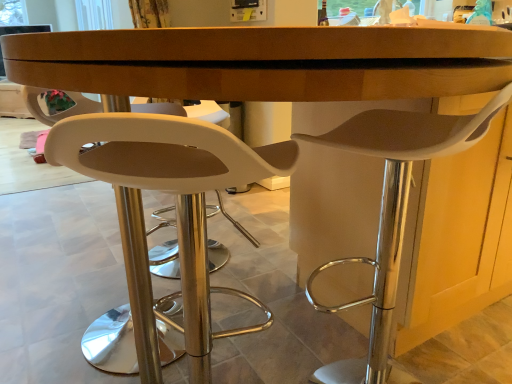
Question: Is white plastic chair at center, placed as the 2th chair when sorted from back to front, smaller than white plastic stool at right, which ranks as the second chair in left-to-right order?

Choices:
 (A) yes
 (B) no

Answer: (A)

Question: Can we say white plastic chair at center, placed as the 2th chair when sorted from back to front, lies outside white plastic stool at right, the second chair viewed from the front?

Choices:
 (A) no
 (B) yes

Answer: (B)

Question: Is there a large distance between white plastic chair at center, marked as the second chair in a right-to-left arrangement, and white plastic stool at right, which ranks as the second chair in left-to-right order?

Choices:
 (A) yes
 (B) no

Answer: (B)

Question: From a real-world perspective, does white plastic chair at center, which is counted as the first chair, starting from the left, sit lower than white plastic stool at right, which ranks as the second chair in left-to-right order?

Choices:
 (A) yes
 (B) no

Answer: (B)

Question: Could you tell me if white plastic chair at center, marked as the second chair in a right-to-left arrangement, is turned towards white plastic stool at right, the second chair viewed from the front?

Choices:
 (A) no
 (B) yes

Answer: (A)

Question: Considering the relative sizes of white plastic chair at center, acting as the 1th chair starting from the front, and white plastic stool at right, which ranks as the second chair in left-to-right order, in the image provided, is white plastic chair at center, acting as the 1th chair starting from the front, bigger than white plastic stool at right, which ranks as the second chair in left-to-right order,?

Choices:
 (A) no
 (B) yes

Answer: (A)

Question: Does white plastic stool at right, the second chair viewed from the front, appear on the left side of white plastic chair at center, marked as the second chair in a right-to-left arrangement?

Choices:
 (A) yes
 (B) no

Answer: (B)

Question: Does white plastic stool at right, the 1th chair viewed from the right, come behind white plastic chair at center, acting as the 1th chair starting from the front?

Choices:
 (A) no
 (B) yes

Answer: (B)

Question: From the image's perspective, is white plastic stool at right, the first chair from the back, on white plastic chair at center, which is counted as the first chair, starting from the left?

Choices:
 (A) no
 (B) yes

Answer: (B)

Question: From a real-world perspective, does white plastic stool at right, which ranks as the second chair in left-to-right order, stand above white plastic chair at center, placed as the 2th chair when sorted from back to front?

Choices:
 (A) no
 (B) yes

Answer: (A)

Question: Considering the relative sizes of white plastic stool at right, the 1th chair viewed from the right, and white plastic chair at center, marked as the second chair in a right-to-left arrangement, in the image provided, is white plastic stool at right, the 1th chair viewed from the right, shorter than white plastic chair at center, marked as the second chair in a right-to-left arrangement,?

Choices:
 (A) no
 (B) yes

Answer: (B)

Question: Is white plastic stool at right, the second chair viewed from the front, far from white plastic chair at center, marked as the second chair in a right-to-left arrangement?

Choices:
 (A) no
 (B) yes

Answer: (A)

Question: From a real-world perspective, is white plastic chair at center, placed as the 2th chair when sorted from back to front, physically located above or below white plastic stool at right, which ranks as the second chair in left-to-right order?

Choices:
 (A) above
 (B) below

Answer: (A)